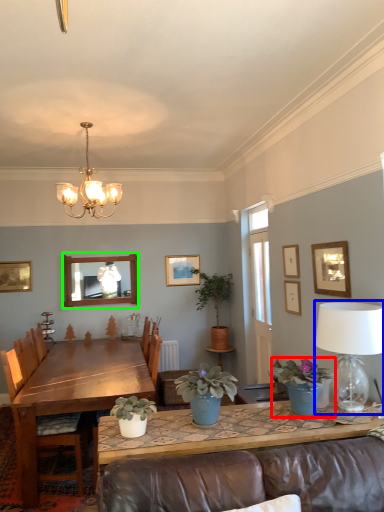
Question: Estimate the real-world distances between objects in this image. Which object is closer to houseplant (highlighted by a red box), table lamp (highlighted by a blue box) or mirror (highlighted by a green box)?

Choices:
 (A) table lamp
 (B) mirror

Answer: (A)